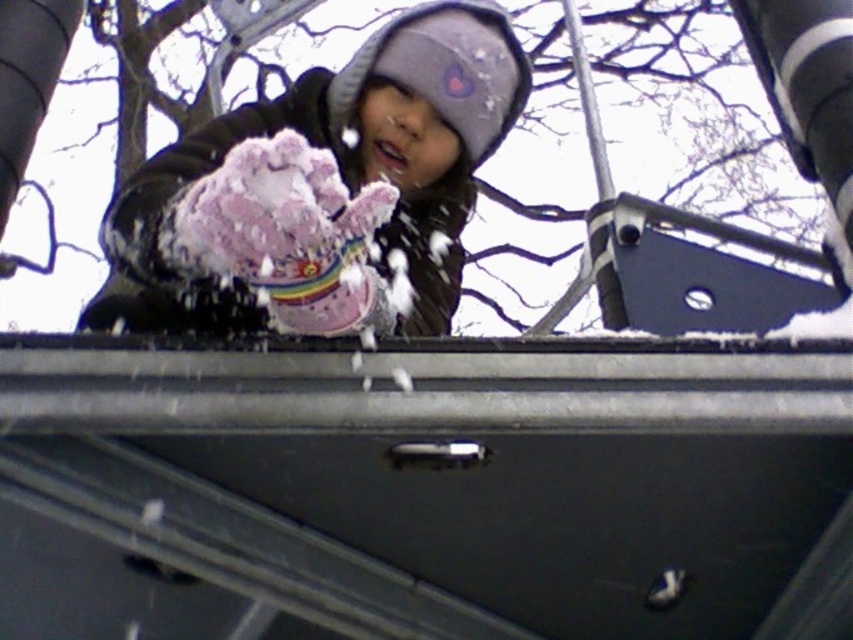
Question: Which object is farther from the camera taking this photo?

Choices:
 (A) pink fuzzy glove at center
 (B) pink fluffy glove at center

Answer: (A)

Question: Does pink fuzzy glove at center have a greater width compared to pink fluffy glove at center?

Choices:
 (A) yes
 (B) no

Answer: (A)

Question: Considering the relative positions of pink fuzzy glove at center and pink fluffy glove at center in the image provided, where is pink fuzzy glove at center located with respect to pink fluffy glove at center?

Choices:
 (A) right
 (B) left

Answer: (A)

Question: From the image, what is the correct spatial relationship of pink fuzzy glove at center in relation to pink fluffy glove at center?

Choices:
 (A) left
 (B) right

Answer: (B)